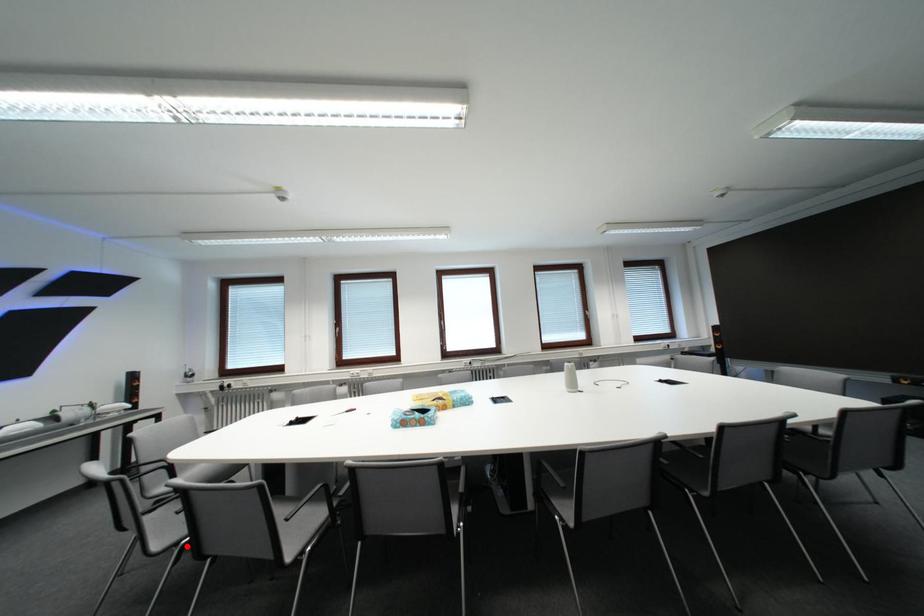
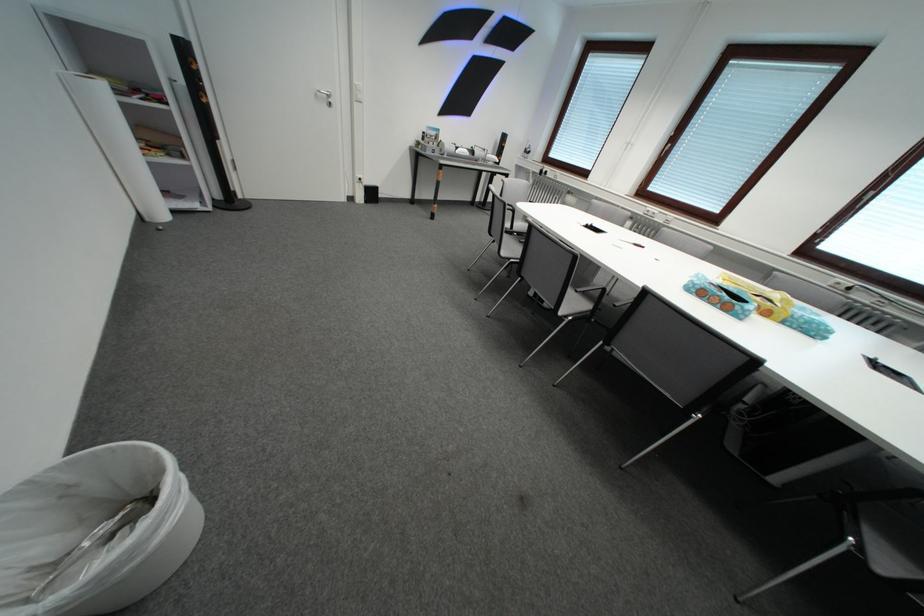
Find the pixel in the second image that matches the highlighted location in the first image.

(519, 262)